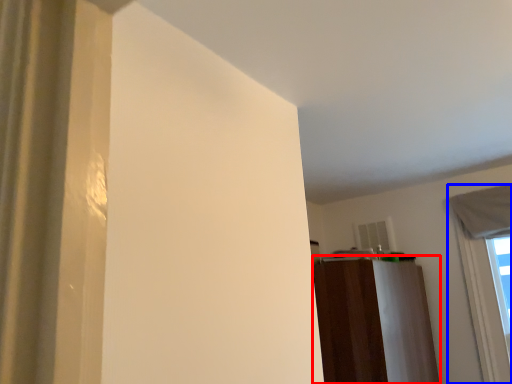
Question: Which object is further to the camera taking this photo, dresser (highlighted by a red box) or window (highlighted by a blue box)?

Choices:
 (A) dresser
 (B) window

Answer: (B)